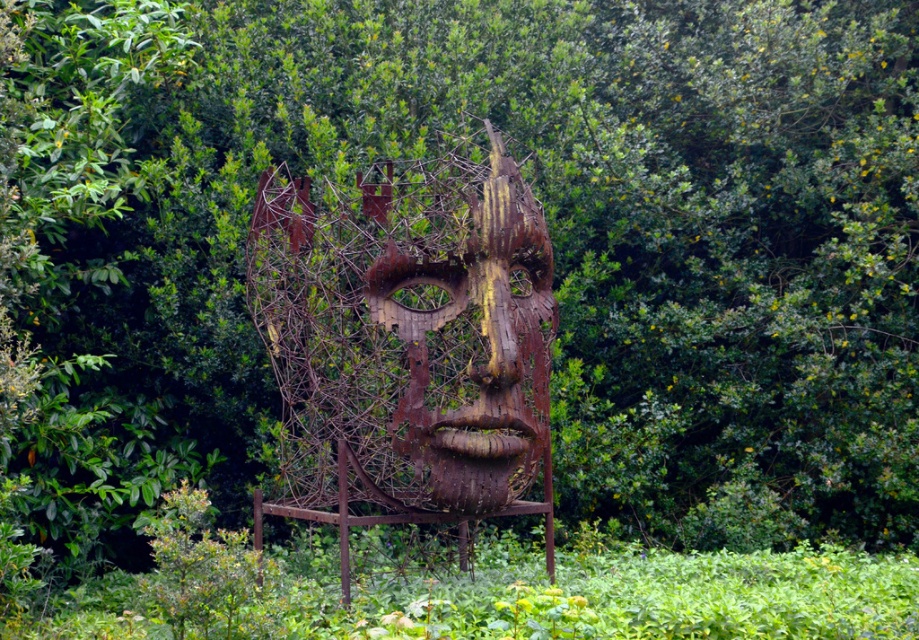
Question: Which object appears farthest from the camera in this image?

Choices:
 (A) rusty wire mesh face at center
 (B) rusty metal face at center

Answer: (A)

Question: Among these points, which one is farthest from the camera?

Choices:
 (A) (475, 355)
 (B) (524, 406)

Answer: (B)

Question: In this image, where is rusty wire mesh face at center located relative to rusty metal face at center?

Choices:
 (A) right
 (B) left

Answer: (B)

Question: From the image, what is the correct spatial relationship of rusty wire mesh face at center in relation to rusty metal face at center?

Choices:
 (A) above
 (B) below

Answer: (A)

Question: Can you confirm if rusty wire mesh face at center is positioned to the right of rusty metal face at center?

Choices:
 (A) yes
 (B) no

Answer: (B)